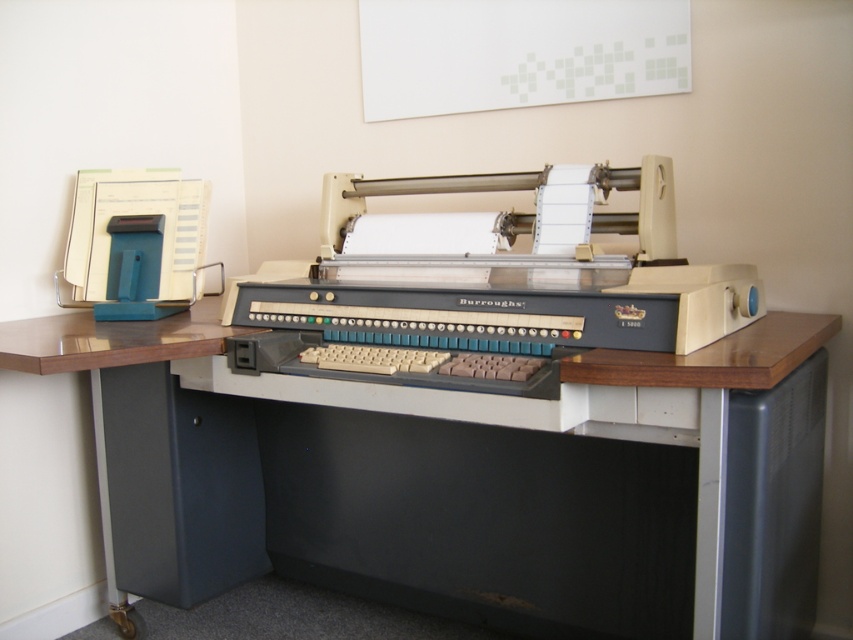
You are standing in front of a vintage Burroughs computer terminal. There is a point labeled at coordinates point (666, 429). Can you reach this point without moving closer to the terminal?

The point (666, 429) is 3.76 feet away from the viewer. Since the distance is more than an average person can reach without moving closer, you cannot reach it without moving closer to the terminal.

You are setting up a vintage Burroughs computer terminal on the wooden desk at center. The beige plastic printer at center needs to be placed next to it. Considering their heights, which object should be placed lower to ensure stability?

The beige plastic printer at center should be placed lower since the wooden desk at center is taller, allowing the printer to rest stably on the desk without overhanging.